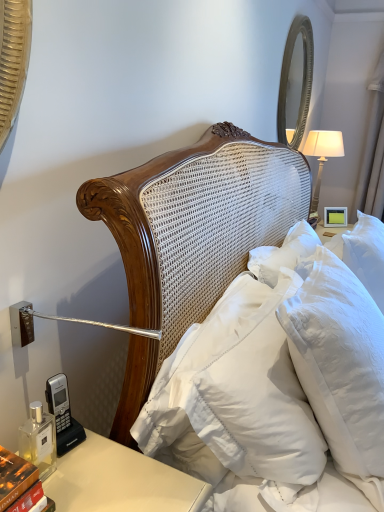
Question: Would you consider white soft pillow at center, the 2th pillow positioned from the right, to be distant from matte yellow picture frame at upper right?

Choices:
 (A) no
 (B) yes

Answer: (B)

Question: Could you tell me if white soft pillow at center, the 2th pillow positioned from the right, is facing matte yellow picture frame at upper right?

Choices:
 (A) yes
 (B) no

Answer: (B)

Question: Is white soft pillow at center, the 2th pillow positioned from the right, oriented away from matte yellow picture frame at upper right?

Choices:
 (A) yes
 (B) no

Answer: (B)

Question: Can you confirm if white soft pillow at center, the first pillow positioned from the left, is positioned to the right of matte yellow picture frame at upper right?

Choices:
 (A) no
 (B) yes

Answer: (A)

Question: From a real-world perspective, is white soft pillow at center, the first pillow positioned from the left, over matte yellow picture frame at upper right?

Choices:
 (A) no
 (B) yes

Answer: (A)

Question: Is white soft pillow at center, the first pillow positioned from the left, further to the viewer compared to matte yellow picture frame at upper right?

Choices:
 (A) no
 (B) yes

Answer: (A)

Question: Does matte yellow picture frame at upper right turn towards silver textured mirror at upper right?

Choices:
 (A) no
 (B) yes

Answer: (A)

Question: Is matte yellow picture frame at upper right touching silver textured mirror at upper right?

Choices:
 (A) no
 (B) yes

Answer: (A)

Question: Is matte yellow picture frame at upper right not within silver textured mirror at upper right?

Choices:
 (A) no
 (B) yes

Answer: (B)

Question: From a real-world perspective, is matte yellow picture frame at upper right on silver textured mirror at upper right?

Choices:
 (A) no
 (B) yes

Answer: (A)

Question: Is matte yellow picture frame at upper right shorter than silver textured mirror at upper right?

Choices:
 (A) no
 (B) yes

Answer: (B)

Question: Is matte yellow picture frame at upper right closer to camera compared to silver textured mirror at upper right?

Choices:
 (A) yes
 (B) no

Answer: (B)

Question: Is hardcover book at lower left behind white soft pillow at center, the first pillow positioned from the left?

Choices:
 (A) yes
 (B) no

Answer: (B)